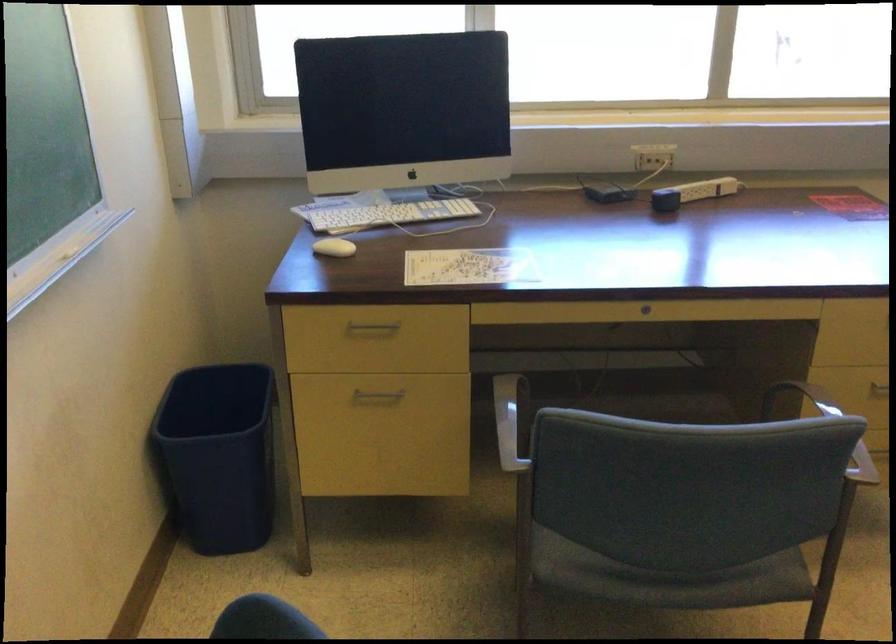
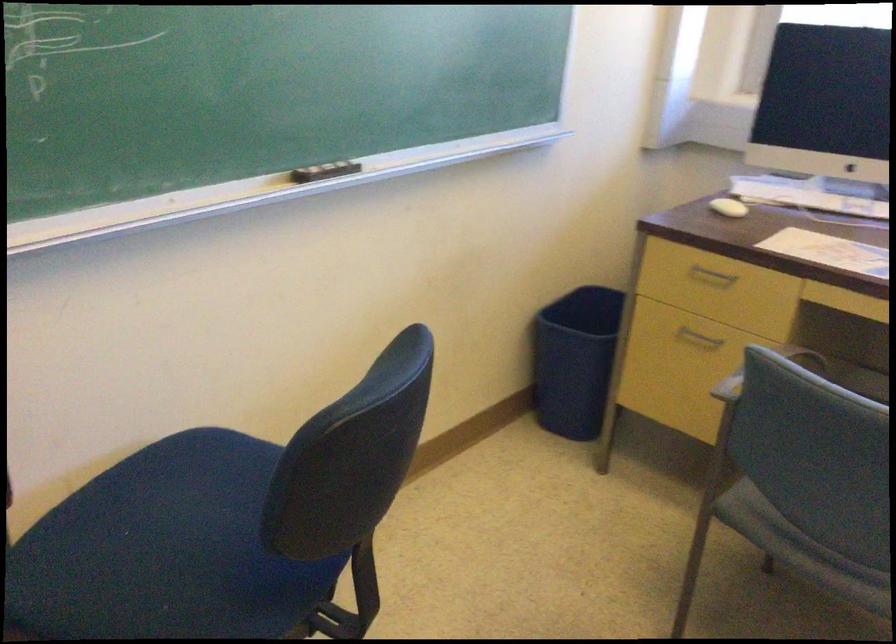
Locate, in the second image, the point that corresponds to (x=366, y=333) in the first image.

(711, 277)